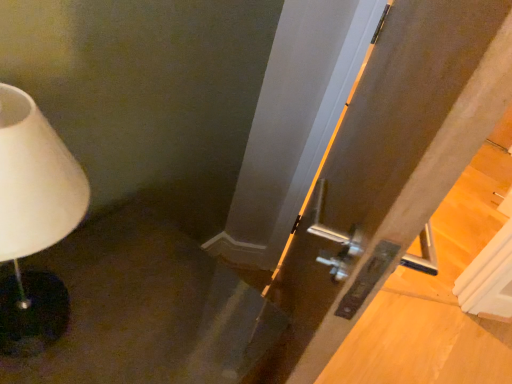
Question: Is metallic silver door at center inside the boundaries of white matte lamp at left, or outside?

Choices:
 (A) inside
 (B) outside

Answer: (B)

Question: Would you say metallic silver door at center is to the left or to the right of white matte lamp at left in the picture?

Choices:
 (A) left
 (B) right

Answer: (B)

Question: In the image, is metallic silver door at center positioned in front of or behind white matte lamp at left?

Choices:
 (A) front
 (B) behind

Answer: (A)

Question: Would you say white matte lamp at left is to the left or to the right of metallic silver door at center in the picture?

Choices:
 (A) right
 (B) left

Answer: (B)

Question: Is white matte lamp at left taller or shorter than metallic silver door at center?

Choices:
 (A) short
 (B) tall

Answer: (A)

Question: Is white matte lamp at left spatially inside metallic silver door at center, or outside of it?

Choices:
 (A) inside
 (B) outside

Answer: (B)

Question: From the image's perspective, relative to metallic silver door at center, is white matte lamp at left above or below?

Choices:
 (A) above
 (B) below

Answer: (A)